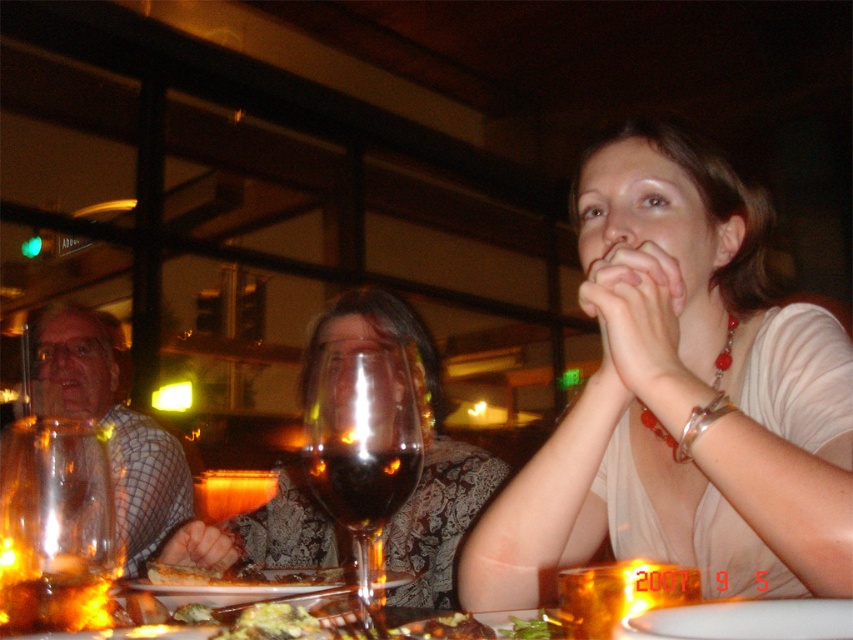
You are a waiter in a restaurant and need to deliver a drink to the customer seated at the table. The customer is located behind the plaid shirt at left and the green leafy salad at center. Which object should you avoid placing the drink near to ensure it doesn t spill?

You should avoid placing the drink near the green leafy salad at center because it is behind the plaid shirt at left, making it closer to the customer s area where the drink might be more likely to spill.

You are a waiter in a restaurant and need to place a small bowl between the white matte shirt at center and the green leafy salad at center. Which object should you place the bowl closer to so it doesn

The white matte shirt at center is taller than the green leafy salad at center, so you should place the bowl closer to the green leafy salad at center to ensure stability and avoid blocking the view of the taller object.

You are a waiter in a restaurant and you need to deliver a dessert to the table where the matte glass wine glass at center and the green leafy salad at center are placed. The dessert needs to be placed between these two items. However, the space between them is only 5 centimeters. Can you fit the dessert there?

The green leafy salad at center is behind the matte glass wine glass at center, so there is no space between them. Therefore, the dessert cannot be placed between them as they are not side by side.